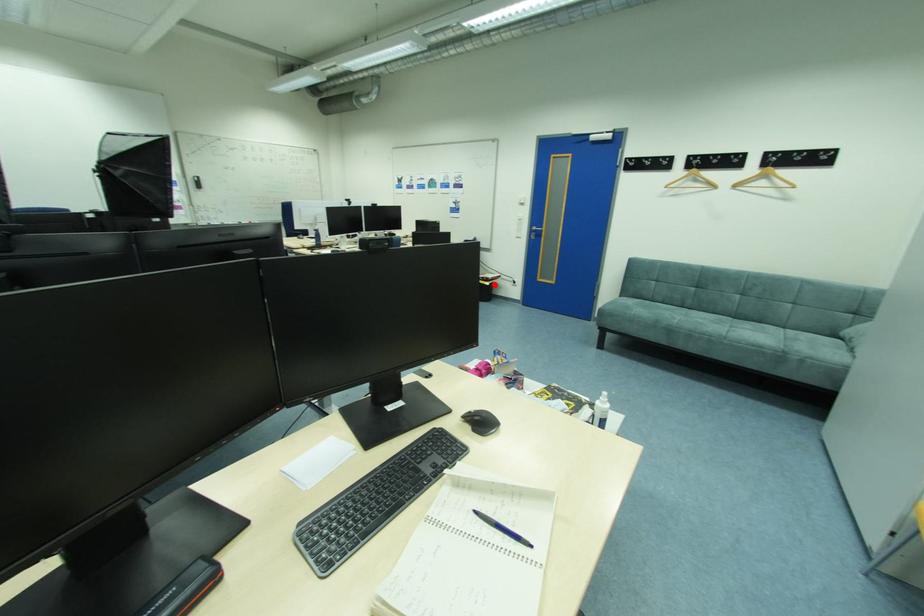
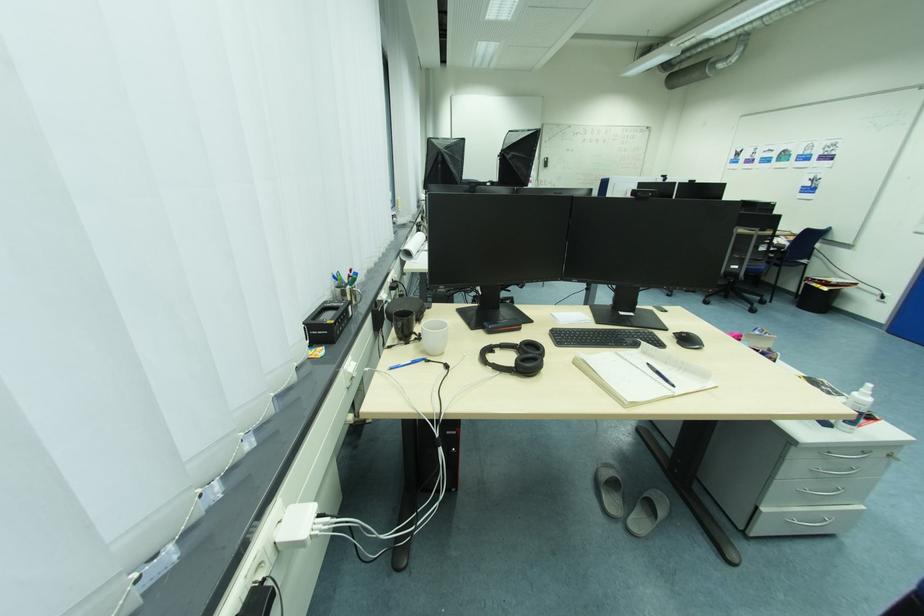
Find the pixel in the second image that matches the highlighted location in the first image.

(833, 290)